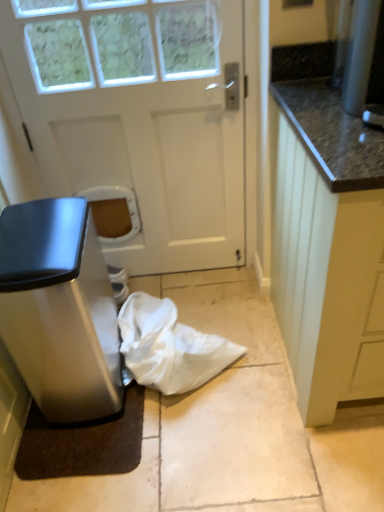
Find the location of a particular element. The height and width of the screenshot is (512, 384). vacant area that lies in front of satin silver trash can at left is located at coordinates (112, 457).